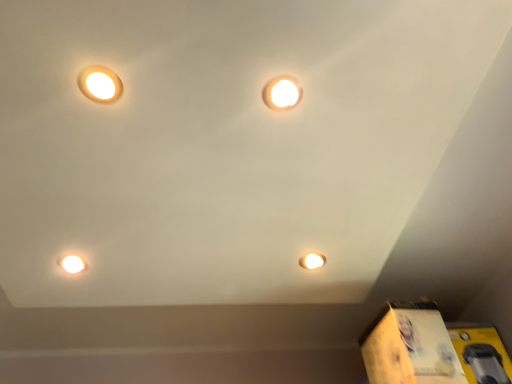
Question: Would you say matte white lamp at upper left, marked as the 2th lamp in a right-to-left arrangement, contains matte white light at upper center, which is the second lamp from left to right?

Choices:
 (A) yes
 (B) no

Answer: (B)

Question: Are matte white lamp at upper left, which is counted as the 1th lamp, starting from the left, and matte white light at upper center, which is the second lamp from left to right, located far from each other?

Choices:
 (A) yes
 (B) no

Answer: (B)

Question: From a real-world perspective, is matte white lamp at upper left, marked as the 2th lamp in a right-to-left arrangement, located higher than matte white light at upper center, which is the second lamp from left to right?

Choices:
 (A) yes
 (B) no

Answer: (B)

Question: Is matte white lamp at upper left, which is counted as the 1th lamp, starting from the left, taller than matte white light at upper center, which is the second lamp from left to right?

Choices:
 (A) no
 (B) yes

Answer: (A)

Question: Does matte white lamp at upper left, marked as the 2th lamp in a right-to-left arrangement, have a greater width compared to matte white light at upper center, the 1th lamp in the right-to-left sequence?

Choices:
 (A) no
 (B) yes

Answer: (A)

Question: From a real-world perspective, is matte white lamp at upper left, marked as the 2th lamp in a right-to-left arrangement, positioned under matte white light at upper center, the 1th lamp in the right-to-left sequence, based on gravity?

Choices:
 (A) no
 (B) yes

Answer: (B)

Question: Is yellow cardboard box at lower right, acting as the 2th cardboard box starting from the left, to the right of matte white light bulb at lower left from the viewer's perspective?

Choices:
 (A) no
 (B) yes

Answer: (B)

Question: From the image's perspective, would you say yellow cardboard box at lower right, which ranks as the first cardboard box in right-to-left order, is positioned over matte white light bulb at lower left?

Choices:
 (A) no
 (B) yes

Answer: (A)

Question: From the image's perspective, does yellow cardboard box at lower right, acting as the 2th cardboard box starting from the left, appear lower than matte white light bulb at lower left?

Choices:
 (A) yes
 (B) no

Answer: (A)

Question: Does yellow cardboard box at lower right, acting as the 2th cardboard box starting from the left, appear on the left side of matte white light bulb at lower left?

Choices:
 (A) no
 (B) yes

Answer: (A)

Question: Are yellow cardboard box at lower right, which ranks as the first cardboard box in right-to-left order, and matte white light bulb at lower left far apart?

Choices:
 (A) no
 (B) yes

Answer: (B)

Question: Is yellow cardboard box at lower right, which ranks as the first cardboard box in right-to-left order, located outside matte white light bulb at lower left?

Choices:
 (A) yes
 (B) no

Answer: (A)

Question: Is yellow cardboard box at lower right, which ranks as the first cardboard box in right-to-left order, thinner than yellow cardboard box at lower right, which ranks as the second cardboard box in right-to-left order?

Choices:
 (A) no
 (B) yes

Answer: (B)